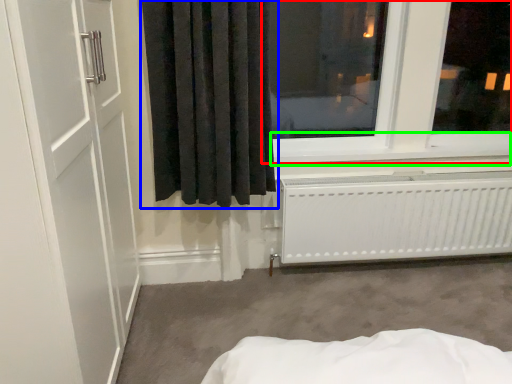
Question: Which is farther away from window (highlighted by a red box)? curtain (highlighted by a blue box) or window sill (highlighted by a green box)?

Choices:
 (A) curtain
 (B) window sill

Answer: (A)